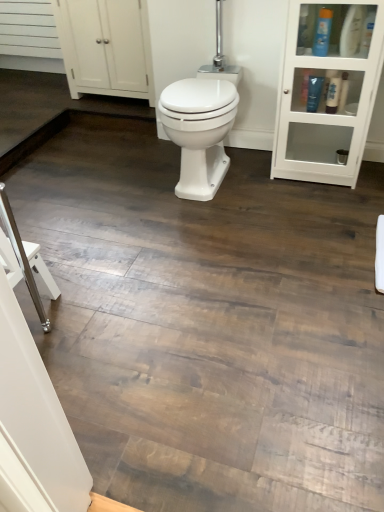
Locate an element on the screen. The image size is (384, 512). vacant space that's between white glossy bidet at center and white glass cabinet at upper right is located at coordinates (265, 185).